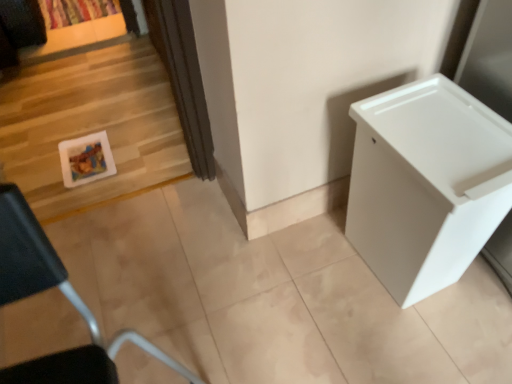
At what (x,y) coordinates should I click in order to perform the action: click on vacant point above white glossy picture frame at left (from a real-world perspective). Please return your answer as a coordinate pair (x, y). Looking at the image, I should click on (86, 155).